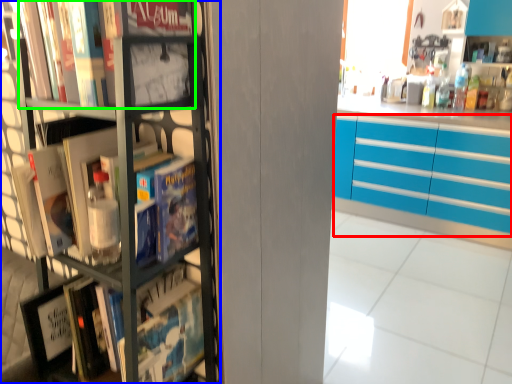
Question: Estimate the real-world distances between objects in this image. Which object is closer to cabinetry (highlighted by a red box), bookcase (highlighted by a blue box) or book (highlighted by a green box)?

Choices:
 (A) bookcase
 (B) book

Answer: (A)